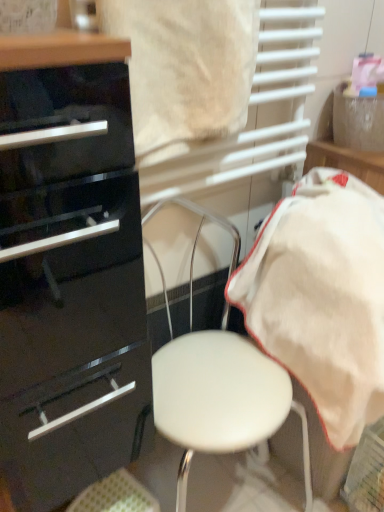
Question: Visually, is white leather stool at center positioned to the left or to the right of white cotton towel at right?

Choices:
 (A) left
 (B) right

Answer: (A)

Question: Does point (200, 395) appear closer or farther from the camera than point (312, 199)?

Choices:
 (A) farther
 (B) closer

Answer: (B)

Question: Which object is positioned closest to the white cotton towel at right?

Choices:
 (A) white leather stool at center
 (B) glossy black chest of drawers at left

Answer: (A)

Question: Which object is the closest to the white cotton towel at right?

Choices:
 (A) glossy black chest of drawers at left
 (B) white leather stool at center

Answer: (B)